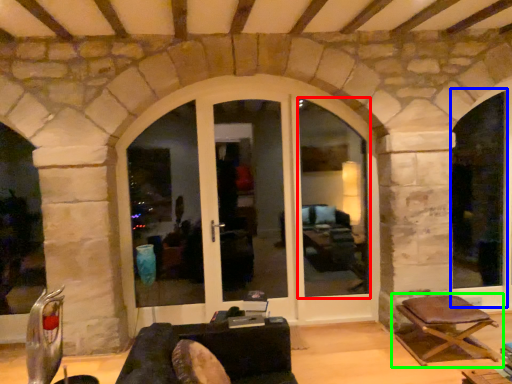
Question: Considering the real-world distances, which object is closest to window frame (highlighted by a red box)? window frame (highlighted by a blue box) or chair (highlighted by a green box).

Choices:
 (A) window frame
 (B) chair

Answer: (A)